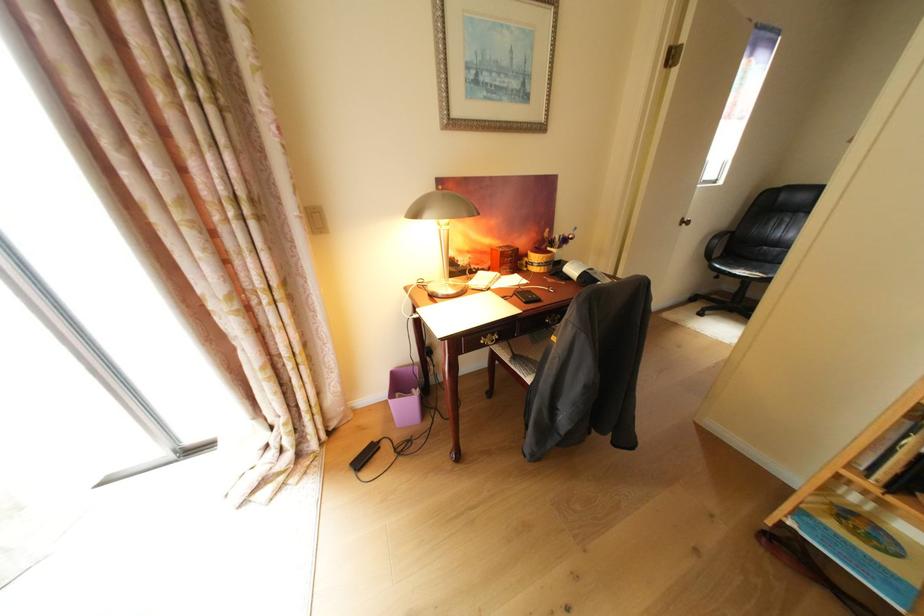
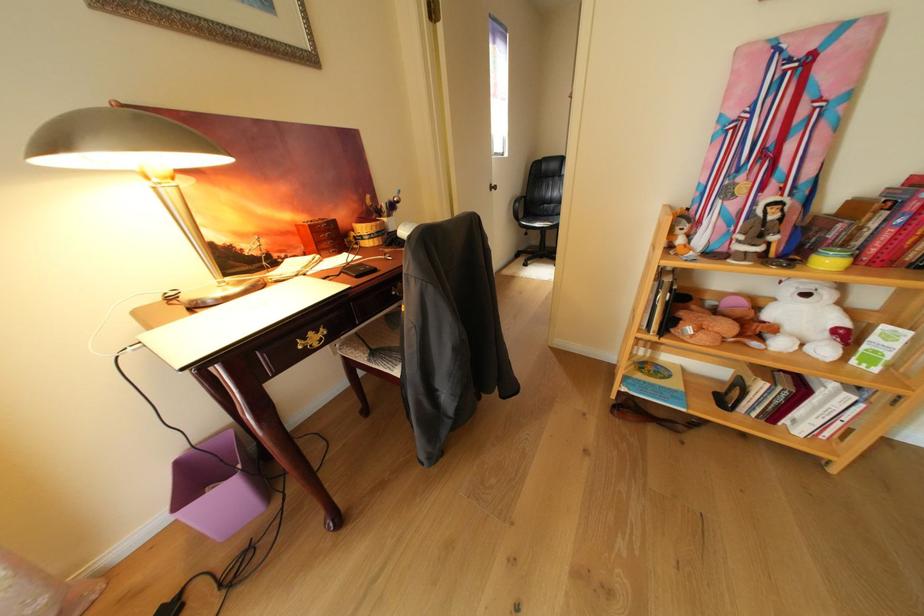
Question: The images are taken continuously from a first-person perspective. In which direction is your viewpoint rotating?

Choices:
 (A) Left
 (B) Right
 (C) Up
 (D) Down

Answer: (B)